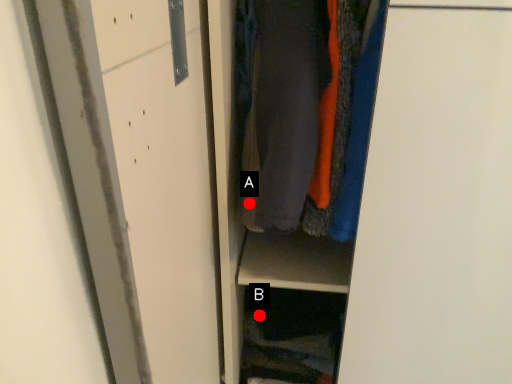
Question: Two points are circled on the image, labeled by A and B beside each circle. Which of the following is the farthest from the observer?

Choices:
 (A) A is further
 (B) B is further

Answer: (B)